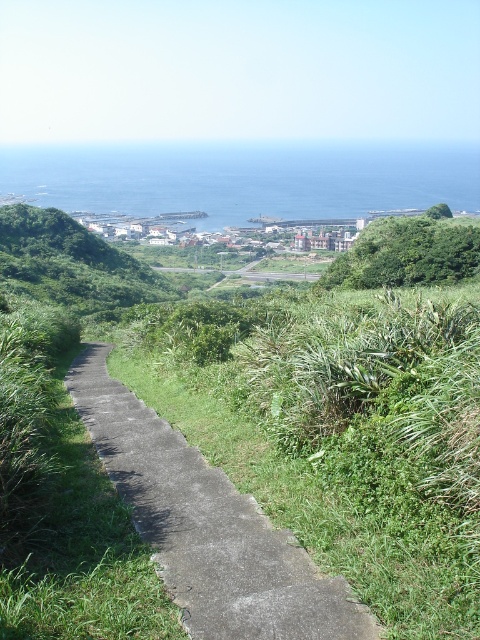
Does point (348, 595) come farther from viewer compared to point (165, 188)?

No, (348, 595) is in front of (165, 188).

Consider the image. Who is shorter, gray concrete path at center or blue water at upper center?

gray concrete path at center is shorter.

The width and height of the screenshot is (480, 640). I want to click on gray concrete path at center, so click(x=207, y=525).

Locate an element on the screen. gray concrete path at center is located at coordinates (207, 525).

Between gray concrete path at center and green grassy hillside at center, which one has less height?

With less height is gray concrete path at center.

The width and height of the screenshot is (480, 640). In order to click on gray concrete path at center in this screenshot , I will do `click(207, 525)`.

I want to click on gray concrete path at center, so [x=207, y=525].

Looking at this image, who is lower down, green grassy hillside at center or green leafy bush at upper right?

green leafy bush at upper right is lower down.

Can you confirm if green grassy hillside at center is positioned above green leafy bush at upper right?

Yes, green grassy hillside at center is above green leafy bush at upper right.

Identify the location of green grassy hillside at center. [x=72, y=262].

The image size is (480, 640). I want to click on green grassy hillside at center, so click(72, 262).